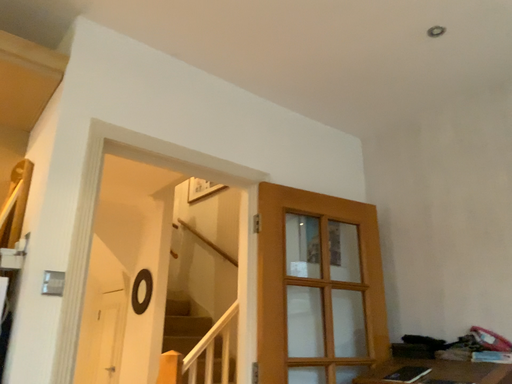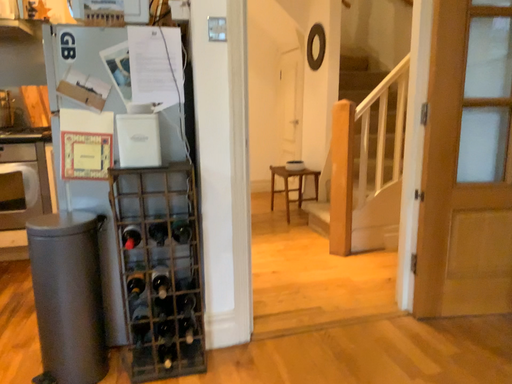
Question: How did the camera likely rotate when shooting the video?

Choices:
 (A) rotated upward
 (B) rotated downward

Answer: (B)